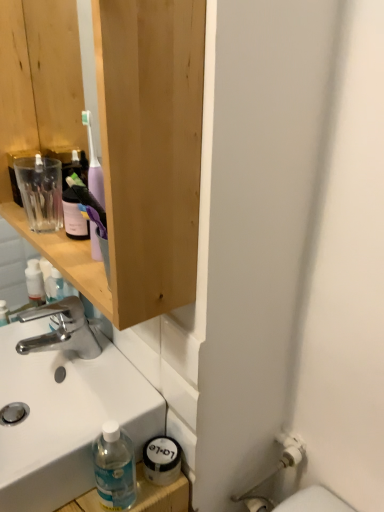
Question: Considering the relative positions of white glossy sink at lower left and polished chrome faucet at center in the image provided, is white glossy sink at lower left to the left of polished chrome faucet at center from the viewer's perspective?

Choices:
 (A) yes
 (B) no

Answer: (A)

Question: From a real-world perspective, is white glossy sink at lower left located beneath polished chrome faucet at center?

Choices:
 (A) yes
 (B) no

Answer: (A)

Question: Is white glossy sink at lower left closer to camera compared to polished chrome faucet at center?

Choices:
 (A) yes
 (B) no

Answer: (A)

Question: Is the surface of white glossy sink at lower left in direct contact with polished chrome faucet at center?

Choices:
 (A) no
 (B) yes

Answer: (A)

Question: Can you confirm if white glossy sink at lower left is smaller than polished chrome faucet at center?

Choices:
 (A) no
 (B) yes

Answer: (A)

Question: From a real-world perspective, is polished chrome faucet at center physically located above or below wooden cabinet at upper left?

Choices:
 (A) above
 (B) below

Answer: (B)

Question: Is polished chrome faucet at center to the left or to the right of wooden cabinet at upper left in the image?

Choices:
 (A) left
 (B) right

Answer: (A)

Question: Considering the positions of polished chrome faucet at center and wooden cabinet at upper left in the image, is polished chrome faucet at center bigger or smaller than wooden cabinet at upper left?

Choices:
 (A) big
 (B) small

Answer: (B)

Question: Is polished chrome faucet at center wider or thinner than wooden cabinet at upper left?

Choices:
 (A) wide
 (B) thin

Answer: (B)

Question: Is wooden cabinet at upper left taller or shorter than polished chrome faucet at center?

Choices:
 (A) tall
 (B) short

Answer: (A)

Question: Do you think wooden cabinet at upper left is within polished chrome faucet at center, or outside of it?

Choices:
 (A) outside
 (B) inside

Answer: (A)

Question: From a real-world perspective, is wooden cabinet at upper left positioned above or below polished chrome faucet at center?

Choices:
 (A) above
 (B) below

Answer: (A)

Question: Considering the positions of wooden cabinet at upper left and polished chrome faucet at center in the image, is wooden cabinet at upper left wider or thinner than polished chrome faucet at center?

Choices:
 (A) wide
 (B) thin

Answer: (A)

Question: Is white glossy sink at lower left situated inside wooden cabinet at upper left or outside?

Choices:
 (A) outside
 (B) inside

Answer: (A)

Question: Is white glossy sink at lower left taller or shorter than wooden cabinet at upper left?

Choices:
 (A) tall
 (B) short

Answer: (B)